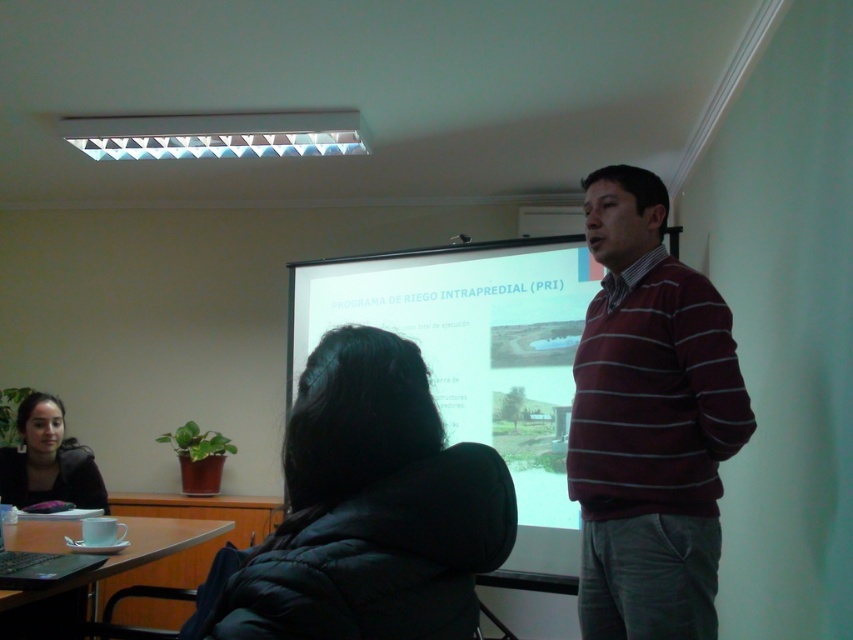
Question: Does maroon striped sweater at right appear on the left side of matte black laptop at lower left?

Choices:
 (A) yes
 (B) no

Answer: (B)

Question: Does maroon striped sweater at right come in front of matte black laptop at lower left?

Choices:
 (A) no
 (B) yes

Answer: (A)

Question: Which of these objects is positioned farthest from the matte black laptop at lower left?

Choices:
 (A) black puffer jacket at center
 (B) white matte projection screen at center
 (C) matte black jacket at lower left

Answer: (B)

Question: Which point is farther from the camera taking this photo?

Choices:
 (A) (53, 572)
 (B) (79, 476)
 (C) (631, 168)

Answer: (B)

Question: Does maroon striped sweater at right appear on the right side of white matte projection screen at center?

Choices:
 (A) no
 (B) yes

Answer: (B)

Question: Which point is farther from the camera taking this photo?

Choices:
 (A) (483, 275)
 (B) (47, 497)
 (C) (90, 556)
 (D) (241, 577)

Answer: (A)